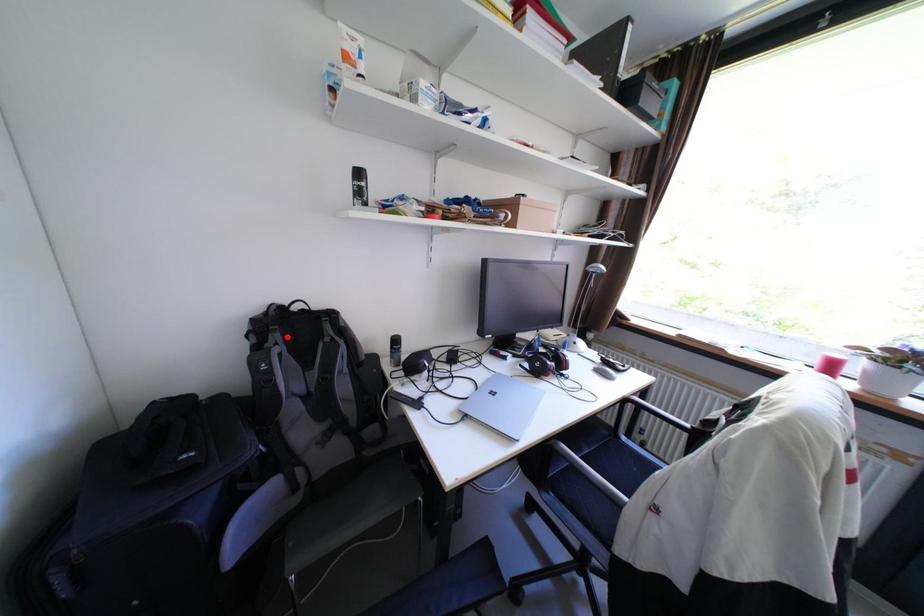
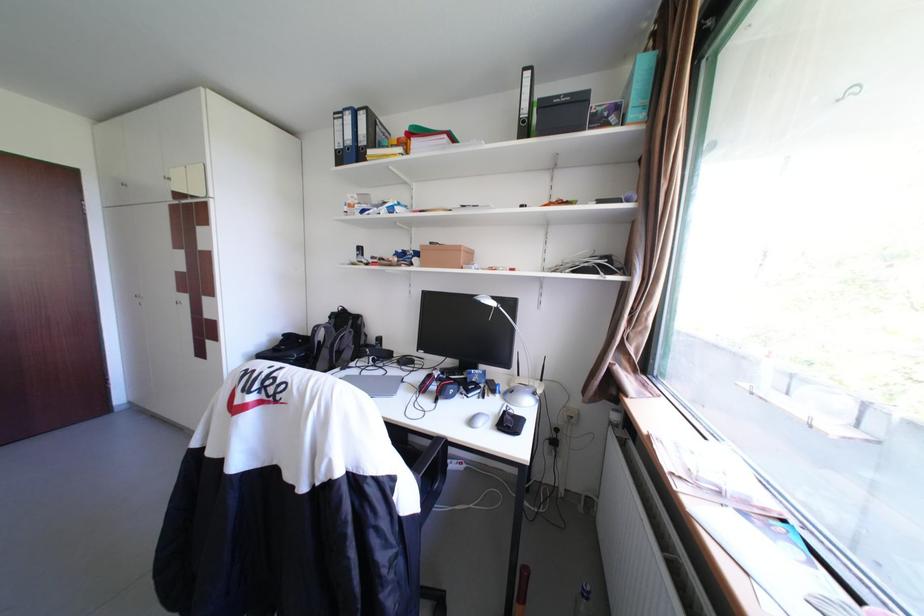
Where in the second image is the point corresponding to the highlighted location from the first image?

(344, 321)